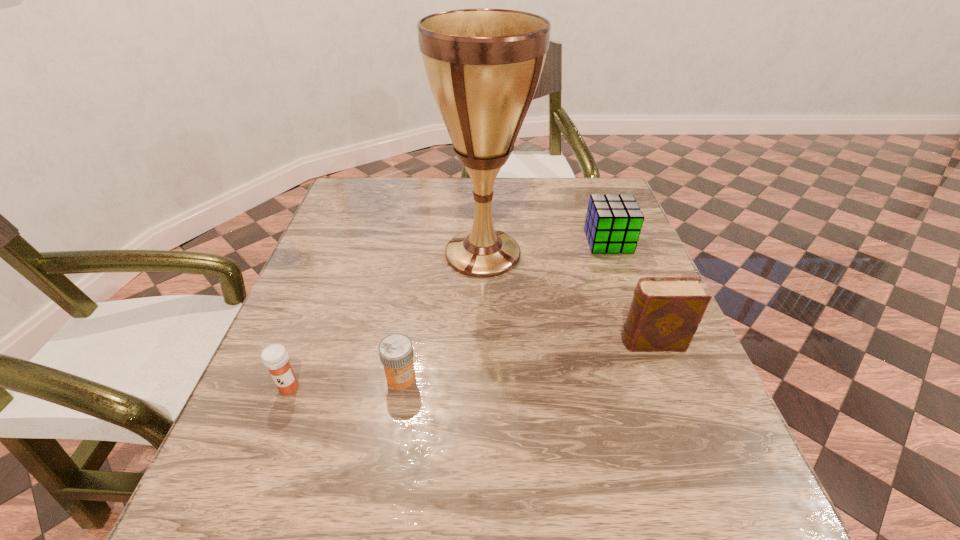
The height and width of the screenshot is (540, 960). What are the coordinates of `free location at the right edge of the desktop` in the screenshot? It's located at (627, 318).

Identify the location of free space at the near left corner. (253, 530).

Identify the location of free space at the far right corner of the desktop. This screenshot has height=540, width=960. (560, 179).

This screenshot has height=540, width=960. Identify the location of free space between the leftmost object and the third object from left to right. (386, 321).

You are a GUI agent. You are given a task and a screenshot of the screen. Output one action in this format:
    pyautogui.click(x=<x>, y=<y>)
    Task: Click on the free spot between the third object from right to left and the right medicine
    The image size is (960, 540).
    Given the screenshot: What is the action you would take?
    pyautogui.click(x=442, y=315)

Find the location of `free area in between the fourth object from right to left and the tallest object`. free area in between the fourth object from right to left and the tallest object is located at coordinates (442, 315).

Identify the location of free spot between the right medicine and the third farthest object. (526, 360).

This screenshot has width=960, height=540. In order to click on empty location between the trophy cup and the right medicine in this screenshot , I will do `click(442, 315)`.

Where is `vacant space that's between the tallest object and the cube`? The height and width of the screenshot is (540, 960). vacant space that's between the tallest object and the cube is located at coordinates (545, 247).

Locate an element on the screen. vacant area that lies between the cube and the third farthest object is located at coordinates (630, 292).